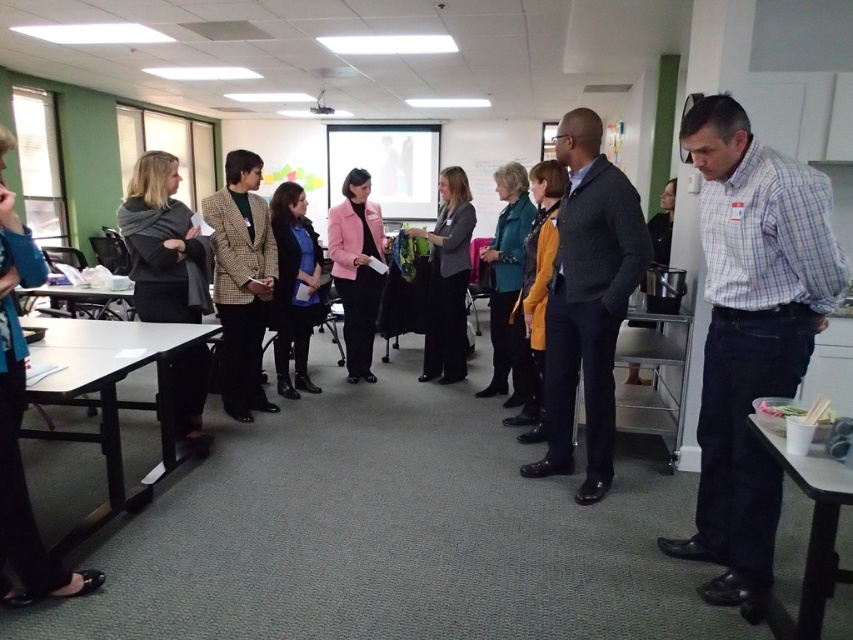
Looking at this image, you are an event planner arranging seating for a presentation. You need to ensure that everyone can see the speaker clearly. The knit sweater at center and the pink matte blazer at center are two attendees in the front row. Which attendee should be seated in a seat with a lower height to avoid blocking the view of those behind them?

The knit sweater at center should be seated in a seat with a lower height because it has a greater height compared to the pink matte blazer at center, which would help prevent blocking the view of others behind.

In the scene shown: You are a person who is 1.7 meters tall and standing in the conference room. You want to reach the smooth black table at lower left to grab a document. Considering your height and the distance, can you comfortably reach the table without needing to stretch?

The smooth black table at lower left is 2.17 meters away from you. Since the average comfortable reaching distance for a person of your height is around 2 meters, you might need to take a small step forward to comfortably reach it without overextending.

You are a new attendee entering the room and want to sit down. The white plastic table at lower right and the teal fabric jacket at center are in your line of sight. Which object should you walk around to reach the table?

The white plastic table at lower right is in front of the teal fabric jacket at center, so you should walk around the teal fabric jacket at center to reach the table.